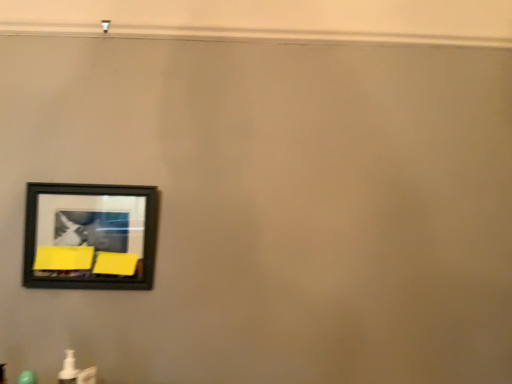
The image size is (512, 384). What do you see at coordinates (90, 236) in the screenshot?
I see `black matte picture frame at upper left` at bounding box center [90, 236].

This screenshot has width=512, height=384. I want to click on black matte picture frame at upper left, so (90, 236).

Locate an element on the screen. This screenshot has width=512, height=384. black matte picture frame at upper left is located at coordinates pyautogui.click(x=90, y=236).